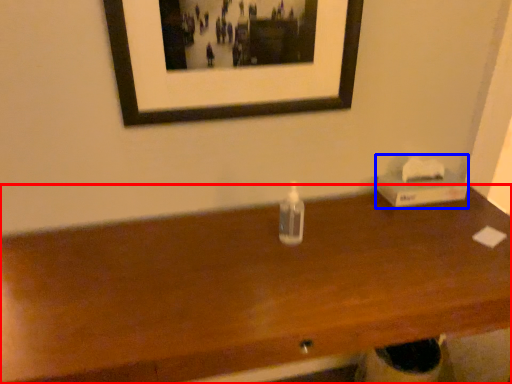
Question: Among these objects, which one is nearest to the camera, table (highlighted by a red box) or box (highlighted by a blue box)?

Choices:
 (A) table
 (B) box

Answer: (A)